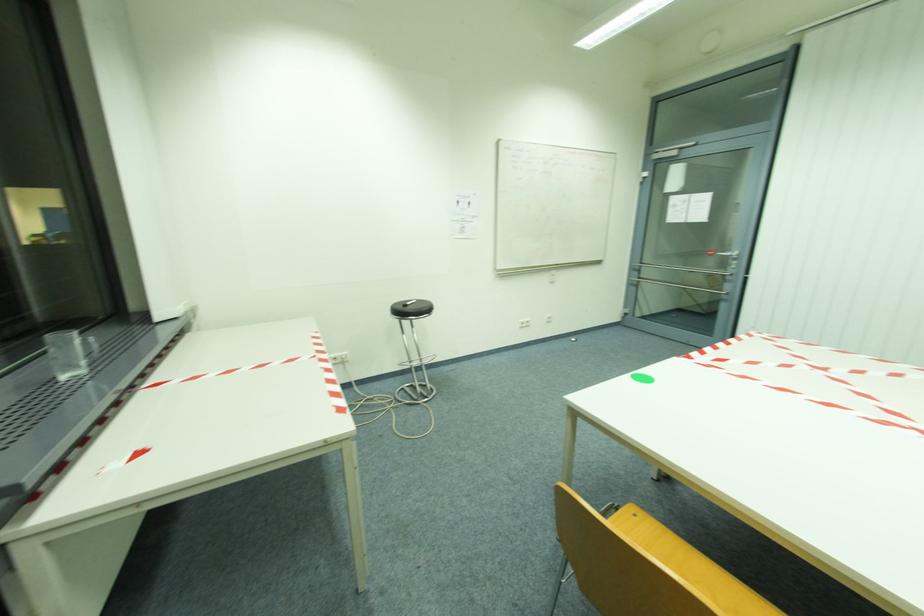
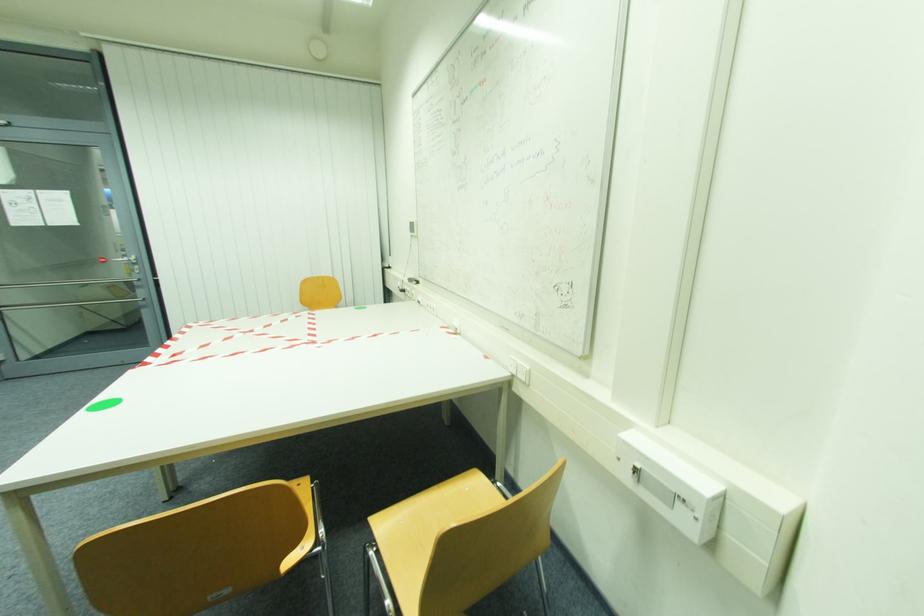
Question: The camera is either moving clockwise (left) or counter-clockwise (right) around the object. The first image is from the beginning of the video and the second image is from the end. Is the camera moving left or right when shooting the video?

Choices:
 (A) Left
 (B) Right

Answer: (A)